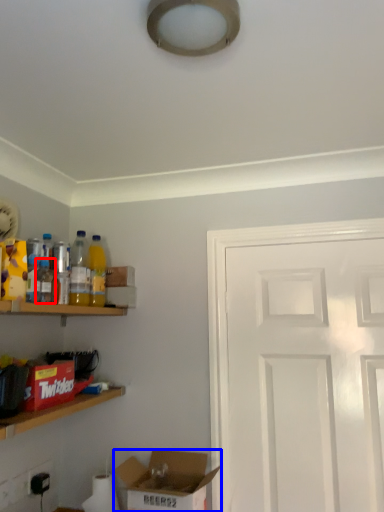
Question: Which point is further to the camera, bottle (highlighted by a red box) or box (highlighted by a blue box)?

Choices:
 (A) bottle
 (B) box

Answer: (A)